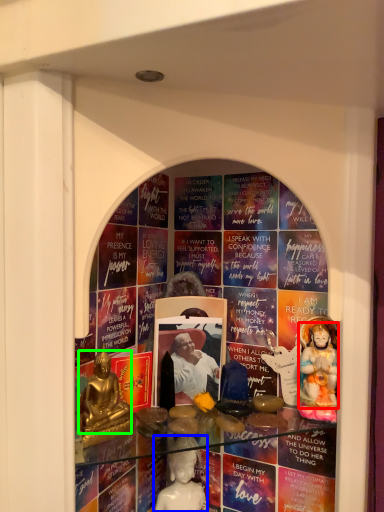
Question: Which is nearer to the person (highlighted by a red box)? person (highlighted by a blue box) or person (highlighted by a green box).

Choices:
 (A) person
 (B) person

Answer: (A)